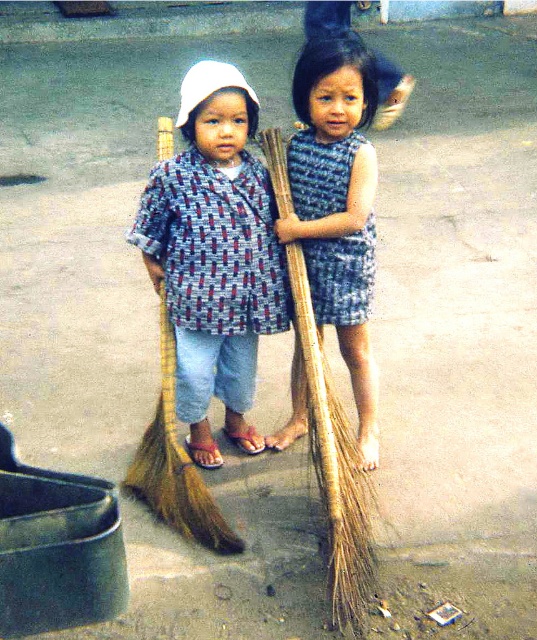
Question: Is matte blue and red checkered shirt at center further to the viewer compared to blue textured dress at center?

Choices:
 (A) yes
 (B) no

Answer: (B)

Question: Where is matte blue and red checkered shirt at center located in relation to blue textured dress at center in the image?

Choices:
 (A) left
 (B) right

Answer: (A)

Question: Which point appears closest to the camera in this image?

Choices:
 (A) (329, 92)
 (B) (169, 220)

Answer: (A)

Question: Which point is farther to the camera?

Choices:
 (A) blue textured dress at center
 (B) matte blue and red checkered shirt at center

Answer: (A)

Question: Is the position of matte blue and red checkered shirt at center less distant than that of blue textured dress at center?

Choices:
 (A) yes
 (B) no

Answer: (A)